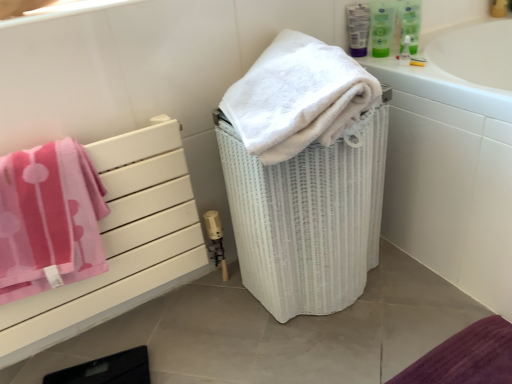
Question: From a real-world perspective, is white fluffy towel at upper right, which ranks as the first towel in right-to-left order, above or below green plastic mouthwash at upper right, arranged as the third mouthwash when viewed from the left?

Choices:
 (A) below
 (B) above

Answer: (A)

Question: Considering the relative positions of white fluffy towel at upper right, positioned as the second towel in left-to-right order, and green plastic mouthwash at upper right, acting as the 1th mouthwash starting from the right, in the image provided, is white fluffy towel at upper right, positioned as the second towel in left-to-right order, to the left or to the right of green plastic mouthwash at upper right, acting as the 1th mouthwash starting from the right,?

Choices:
 (A) left
 (B) right

Answer: (A)

Question: Considering the real-world distances, which object is farthest from the white fluffy towel at upper right, which ranks as the first towel in right-to-left order?

Choices:
 (A) white wicker laundry basket at center
 (B) green plastic mouthwash at upper right, arranged as the third mouthwash when viewed from the left
 (C) pink terry cloth towel at left, positioned as the 1th towel in left-to-right order
 (D) translucent plastic mouthwash at upper right, acting as the third mouthwash starting from the right
 (E) white glossy bathtub at upper right

Answer: (D)

Question: Which object is positioned closest to the green plastic mouthwash at upper right, arranged as the third mouthwash when viewed from the left?

Choices:
 (A) white wicker laundry basket at center
 (B) pink terry cloth towel at left, positioned as the 1th towel in left-to-right order
 (C) green plastic mouthwash at upper right, arranged as the 2th mouthwash when viewed from the left
 (D) pink fabric towel at left
 (E) translucent plastic mouthwash at upper right, which is the 1th mouthwash in left-to-right order

Answer: (C)